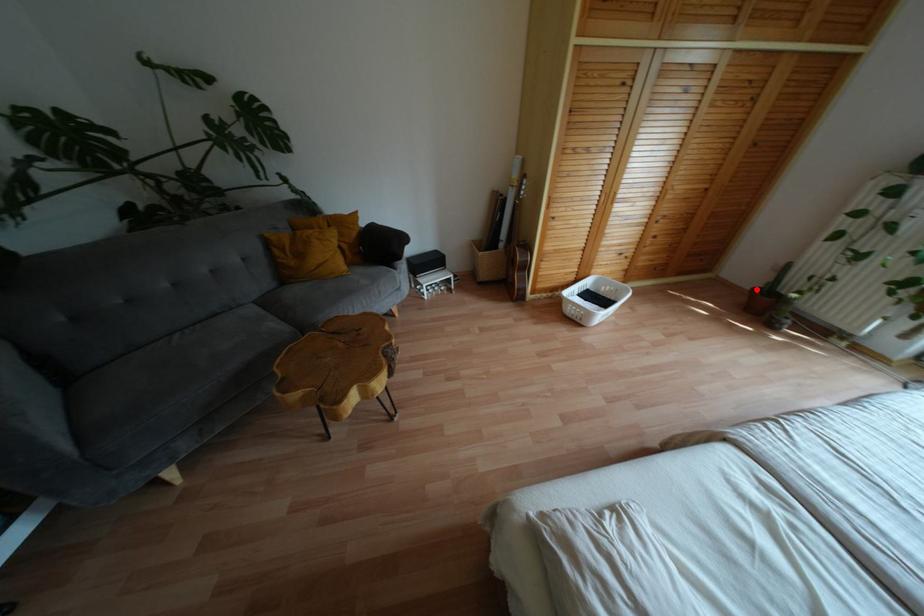
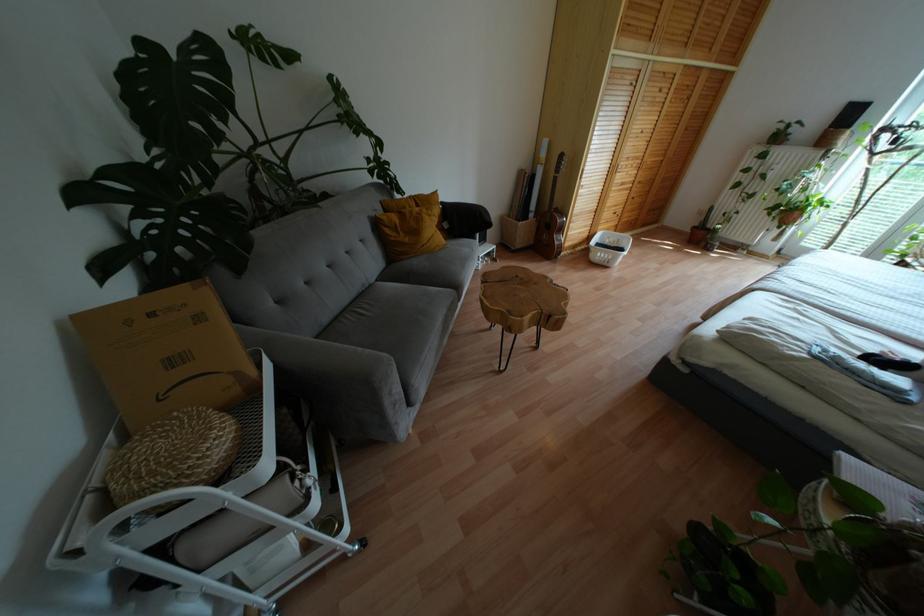
Question: I am providing you with two images of the same scene from different viewpoints. A red point is marked on the first image. Can you still see the location of the red point in image 2?

Choices:
 (A) Yes
 (B) No

Answer: (A)